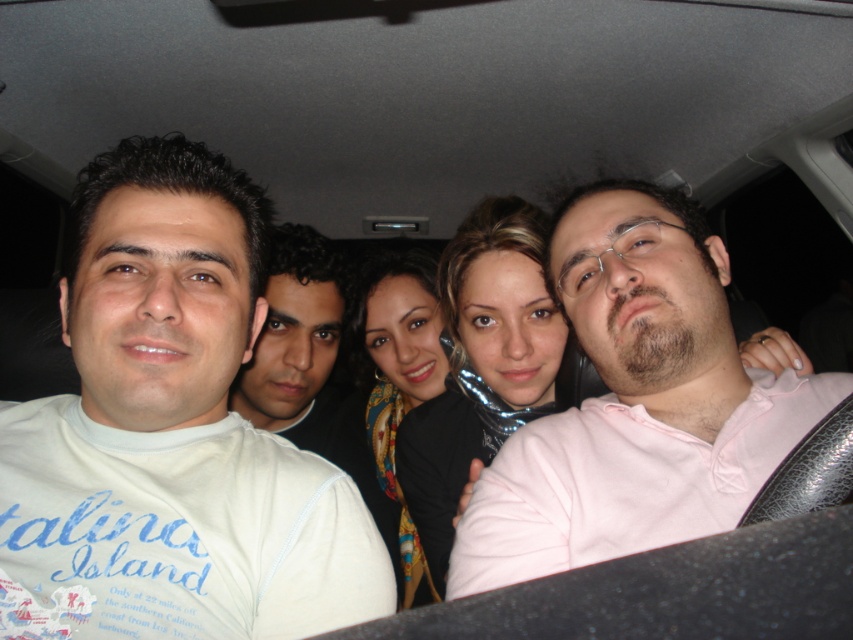
You are a photographer trying to adjust the lighting in the car. You notice the white cotton shirt at left and the pink cotton shirt at center. Which shirt should you focus your light on to ensure it reflects more light?

The white cotton shirt at left should be focused on because white reflects more light than pink.

You are a photographer trying to adjust the lighting in the car to make sure both the pink cotton shirt at center and the white cotton shirt at center are visible. Based on their positions, which shirt might need more light to be seen clearly?

The pink cotton shirt at center is positioned over the white cotton shirt at center, so the white cotton shirt at center might be partially obscured and need more light to be seen clearly.

You are a photographer trying to adjust the lighting in the car to ensure both the white cotton shirt at left and the white cotton shirt at center are evenly illuminated. Since the car interior is dimly lit, which shirt might require more light adjustment to avoid appearing too bright?

The white cotton shirt at left has a larger width than the white cotton shirt at center. Since it is bigger, it might reflect more light and could require more careful adjustment to prevent overexposure compared to the smaller shirt at center.